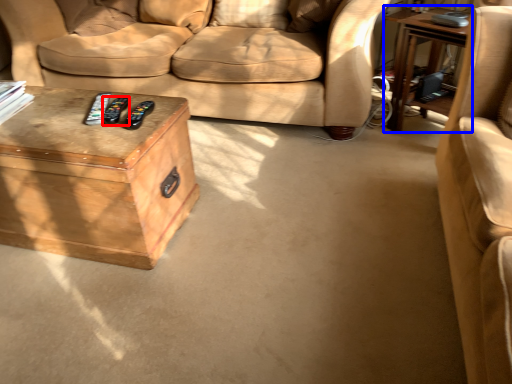
Question: Among these objects, which one is farthest to the camera, remote (highlighted by a red box) or table (highlighted by a blue box)?

Choices:
 (A) remote
 (B) table

Answer: (B)